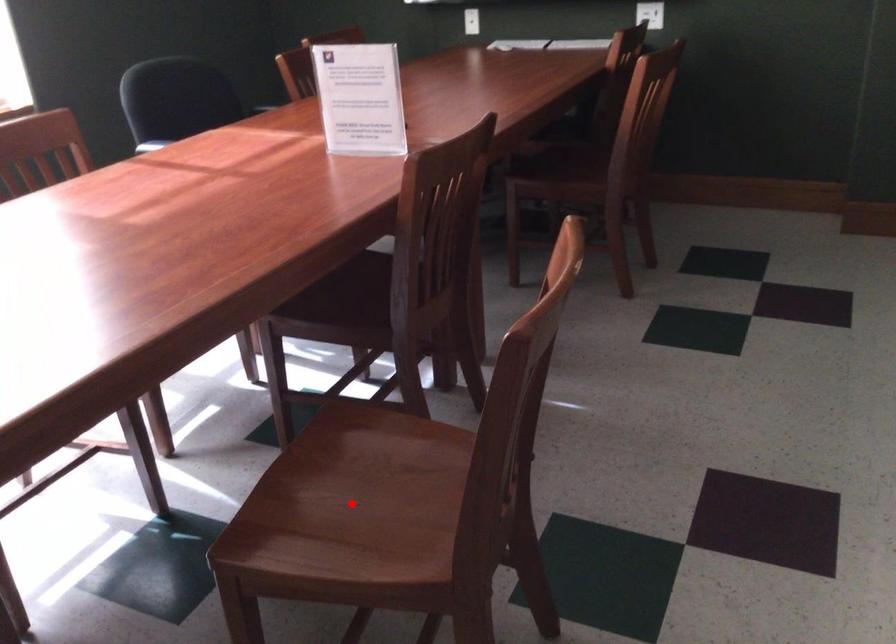
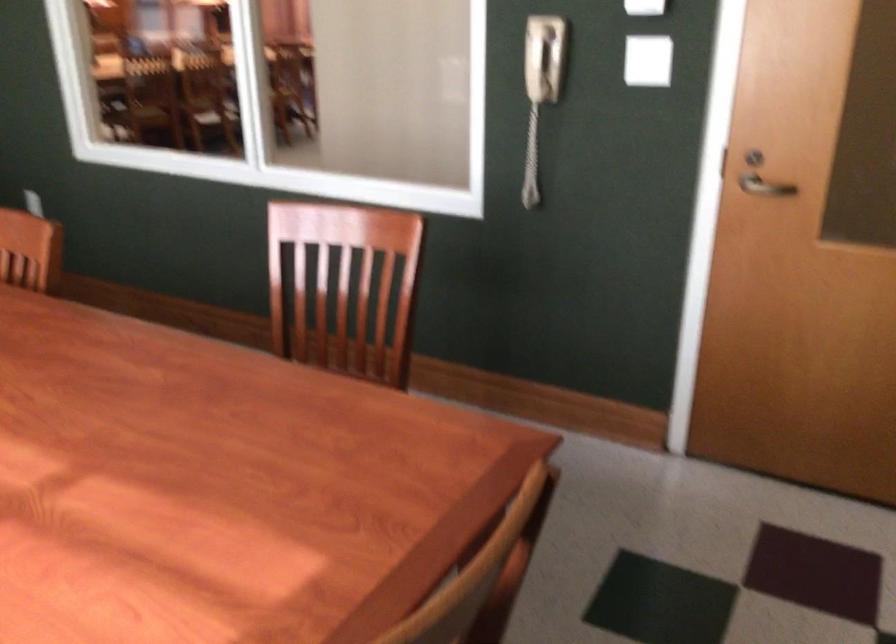
Question: I am providing you with two images of the same scene from different viewpoints. A red point is marked on the first image. At the location where the point appears in image 1, is it still visible in image 2?

Choices:
 (A) Yes
 (B) No

Answer: (B)